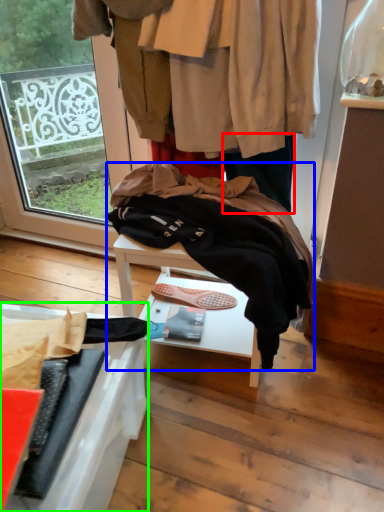
Question: Considering the real-world distances, which object is closest to trousers (highlighted by a red box)? wool (highlighted by a blue box) or furniture (highlighted by a green box).

Choices:
 (A) wool
 (B) furniture

Answer: (A)